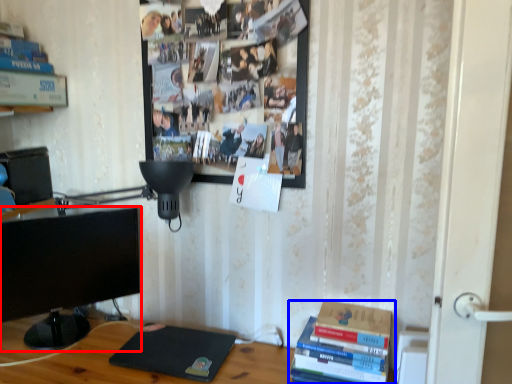
Question: Which object is closer to the camera taking this photo, television (highlighted by a red box) or book (highlighted by a blue box)?

Choices:
 (A) television
 (B) book

Answer: (B)